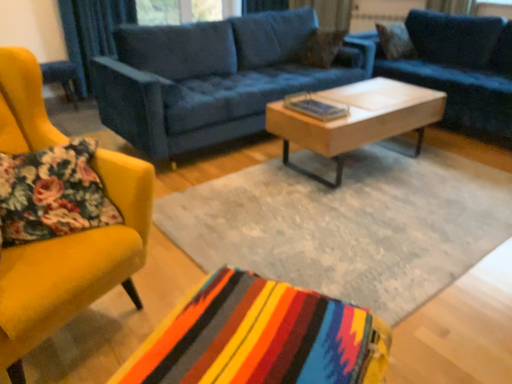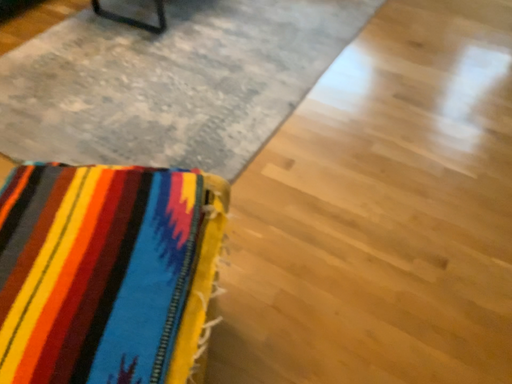
Question: How did the camera likely rotate when shooting the video?

Choices:
 (A) rotated downward
 (B) rotated upward

Answer: (A)